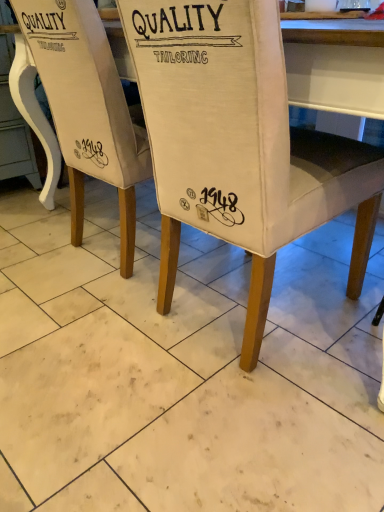
Question: Should I look upward or downward to see canvas chair at center, arranged as the second chair when viewed from the right?

Choices:
 (A) down
 (B) up

Answer: (B)

Question: Is canvas chair at center, arranged as the second chair when viewed from the right, oriented towards white fabric chair at center, marked as the second chair in a left-to-right arrangement?

Choices:
 (A) no
 (B) yes

Answer: (A)

Question: Considering the relative positions of canvas chair at center, arranged as the second chair when viewed from the right, and white fabric chair at center, which is the first chair in right-to-left order, in the image provided, is canvas chair at center, arranged as the second chair when viewed from the right, to the right of white fabric chair at center, which is the first chair in right-to-left order, from the viewer's perspective?

Choices:
 (A) yes
 (B) no

Answer: (B)

Question: From a real-world perspective, does canvas chair at center, arranged as the 1th chair when viewed from the left, stand above white fabric chair at center, marked as the second chair in a left-to-right arrangement?

Choices:
 (A) yes
 (B) no

Answer: (A)

Question: Is white fabric chair at center, which is the first chair in right-to-left order, at the back of canvas chair at center, arranged as the 1th chair when viewed from the left?

Choices:
 (A) no
 (B) yes

Answer: (A)

Question: From the image's perspective, is canvas chair at center, arranged as the second chair when viewed from the right, located above white fabric chair at center, which is the first chair in right-to-left order?

Choices:
 (A) yes
 (B) no

Answer: (A)

Question: Is canvas chair at center, arranged as the 1th chair when viewed from the left, outside white fabric chair at center, marked as the second chair in a left-to-right arrangement?

Choices:
 (A) no
 (B) yes

Answer: (B)

Question: Is white fabric chair at center, which is the first chair in right-to-left order, far away from canvas chair at center, arranged as the 1th chair when viewed from the left?

Choices:
 (A) no
 (B) yes

Answer: (A)

Question: Is canvas chair at center, arranged as the 1th chair when viewed from the left, at the back of white fabric chair at center, which is the first chair in right-to-left order?

Choices:
 (A) yes
 (B) no

Answer: (B)

Question: Does white fabric chair at center, marked as the second chair in a left-to-right arrangement, have a lesser height compared to canvas chair at center, arranged as the second chair when viewed from the right?

Choices:
 (A) yes
 (B) no

Answer: (A)

Question: From the image's perspective, is white fabric chair at center, marked as the second chair in a left-to-right arrangement, over canvas chair at center, arranged as the second chair when viewed from the right?

Choices:
 (A) yes
 (B) no

Answer: (B)

Question: Does white fabric chair at center, marked as the second chair in a left-to-right arrangement, appear on the left side of canvas chair at center, arranged as the second chair when viewed from the right?

Choices:
 (A) yes
 (B) no

Answer: (B)

Question: Can you confirm if white fabric chair at center, which is the first chair in right-to-left order, is positioned to the right of canvas chair at center, arranged as the second chair when viewed from the right?

Choices:
 (A) yes
 (B) no

Answer: (A)

Question: From the image's perspective, relative to canvas chair at center, arranged as the second chair when viewed from the right, is white fabric chair at center, marked as the second chair in a left-to-right arrangement, above or below?

Choices:
 (A) above
 (B) below

Answer: (B)